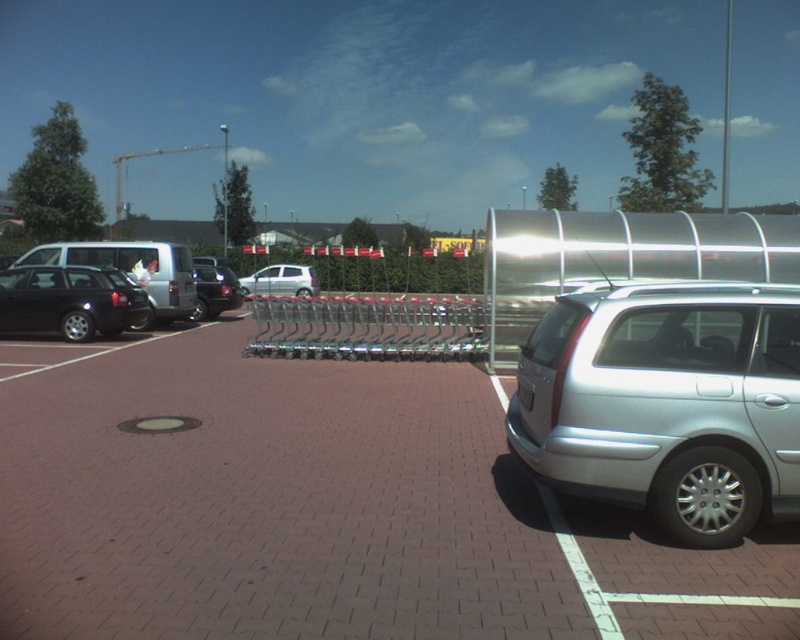
Is shiny black sedan at center below silver metallic hatchback at center?

Yes.

Measure the distance between shiny black sedan at center and camera.

A distance of 19.61 meters exists between shiny black sedan at center and camera.

Does point (234, 307) come in front of point (292, 278)?

Yes, point (234, 307) is in front of point (292, 278).

This screenshot has height=640, width=800. Find the location of `shiny black sedan at center`. shiny black sedan at center is located at coordinates (214, 289).

Between brick pavement at center and silver metallic hatchback at center, which one has less height?

With less height is brick pavement at center.

Where is `brick pavement at center`? brick pavement at center is located at coordinates (322, 509).

Between point (218, 403) and point (276, 262), which one is positioned in front?

Point (218, 403) is in front.

Identify the location of brick pavement at center. The height and width of the screenshot is (640, 800). (322, 509).

Can you confirm if shiny black sedan at left is positioned to the left of shiny black sedan at center?

Correct, you'll find shiny black sedan at left to the left of shiny black sedan at center.

Measure the distance between shiny black sedan at left and shiny black sedan at center.

shiny black sedan at left and shiny black sedan at center are 13.95 feet apart.

Locate an element on the screen. This screenshot has width=800, height=640. shiny black sedan at left is located at coordinates (69, 301).